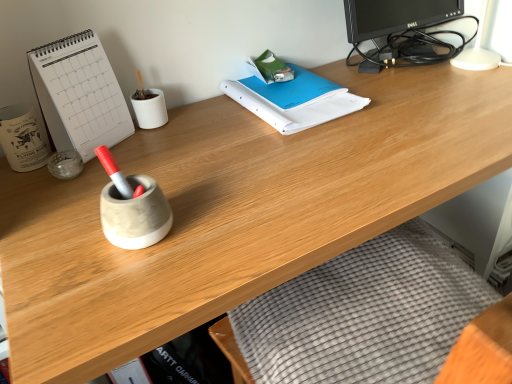
Locate an element on the screen. The height and width of the screenshot is (384, 512). vacant space to the right of blue paper binder at center is located at coordinates (406, 96).